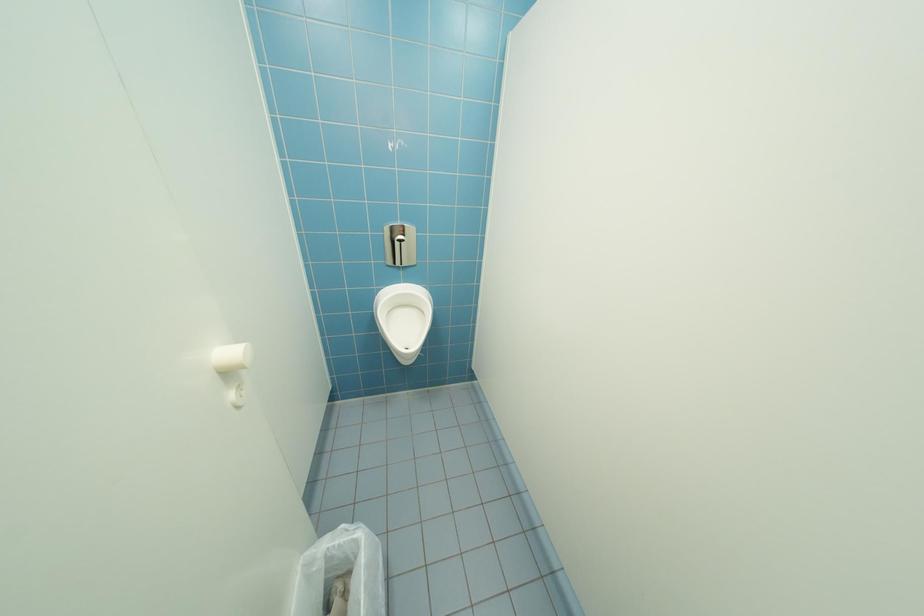
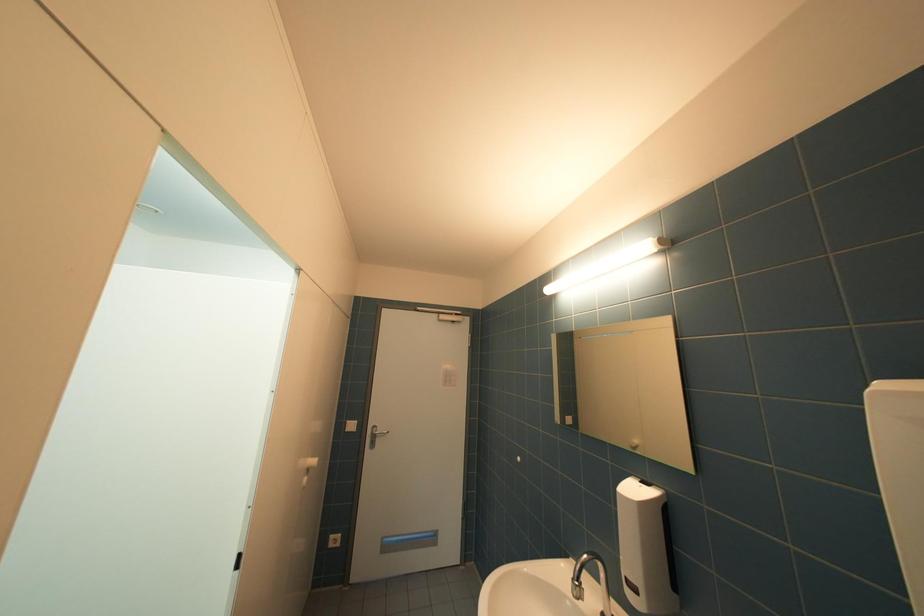
Question: The camera is either moving clockwise (left) or counter-clockwise (right) around the object. The first image is from the beginning of the video and the second image is from the end. Is the camera moving left or right when shooting the video?

Choices:
 (A) Left
 (B) Right

Answer: (A)